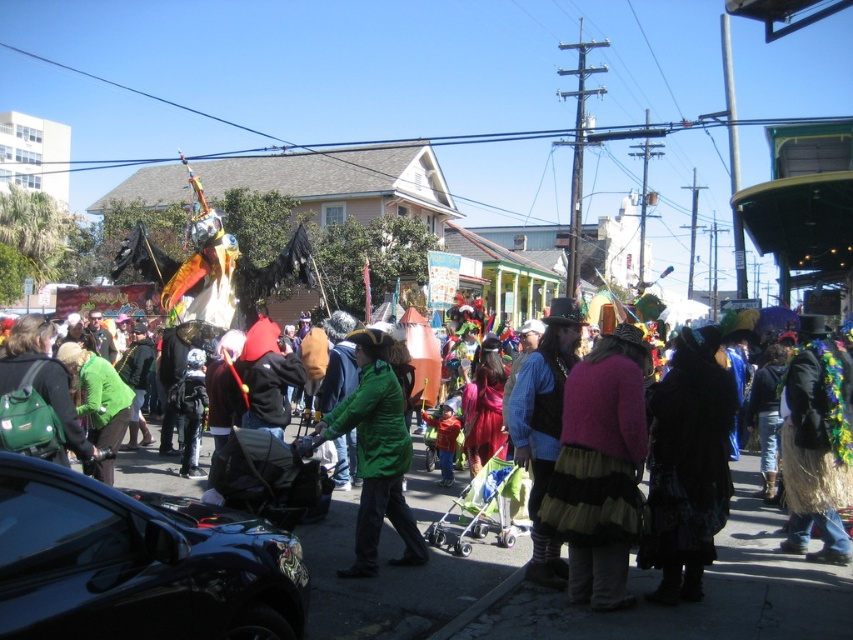
Between pink tulle skirt at center and black textured dress at center, which one has more height?

pink tulle skirt at center

Based on the photo, does pink tulle skirt at center have a lesser height compared to black textured dress at center?

Incorrect, pink tulle skirt at center's height does not fall short of black textured dress at center's.

The height and width of the screenshot is (640, 853). I want to click on pink tulle skirt at center, so click(x=601, y=468).

This screenshot has height=640, width=853. In order to click on pink tulle skirt at center in this screenshot , I will do `click(601, 468)`.

Between point (659, 595) and point (836, 522), which one is positioned in front?

Point (659, 595)

Between point (735, 403) and point (816, 500), which one is positioned behind?

The point (816, 500) is more distant.

Between point (701, 516) and point (805, 362), which one is positioned behind?

Positioned behind is point (805, 362).

This screenshot has width=853, height=640. I want to click on black textured dress at center, so click(x=688, y=465).

Is point (97, 548) positioned after point (368, 550)?

No.

Measure the distance between shiny metallic balloon at center and camera.

The distance of shiny metallic balloon at center from camera is 9.61 meters.

Between point (28, 536) and point (392, 436), which one is positioned behind?

Point (392, 436)

I want to click on shiny metallic balloon at center, so click(x=142, y=547).